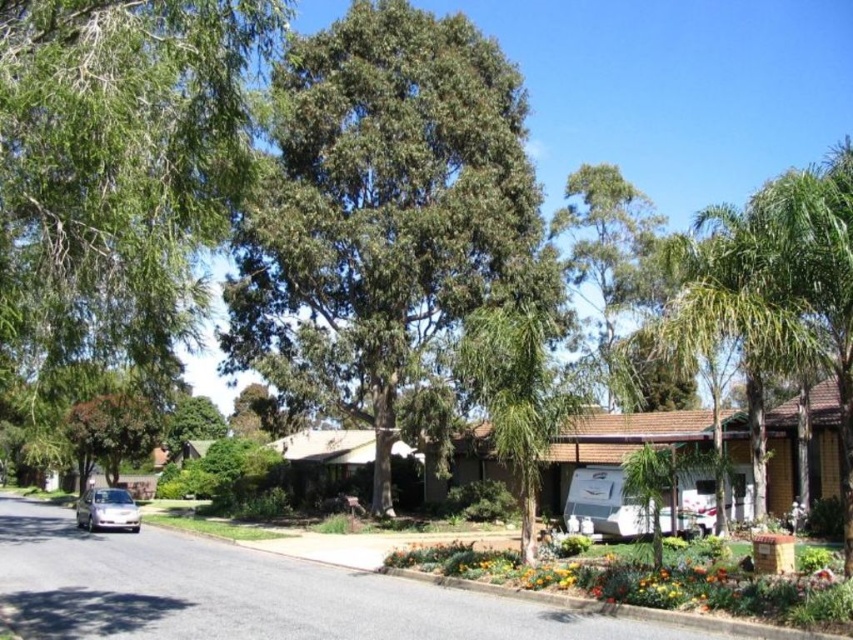
Question: Is green leafy tree at center above green leafy palm tree at right?

Choices:
 (A) no
 (B) yes

Answer: (A)

Question: Does green leafy tree at upper center have a greater width compared to silver metallic car at lower left?

Choices:
 (A) yes
 (B) no

Answer: (A)

Question: Which object is closer to the camera taking this photo?

Choices:
 (A) green leafy tree at left
 (B) green leafy tree at upper center
 (C) silver metallic car at lower left

Answer: (A)

Question: Which point is farther to the camera?

Choices:
 (A) (595, 182)
 (B) (814, 298)
 (C) (4, 243)
 (D) (398, 154)

Answer: (A)

Question: Does green leafy tree at upper center appear over silver metallic car at lower left?

Choices:
 (A) yes
 (B) no

Answer: (A)

Question: Which point appears closest to the camera in this image?

Choices:
 (A) (68, 316)
 (B) (241, 310)

Answer: (A)